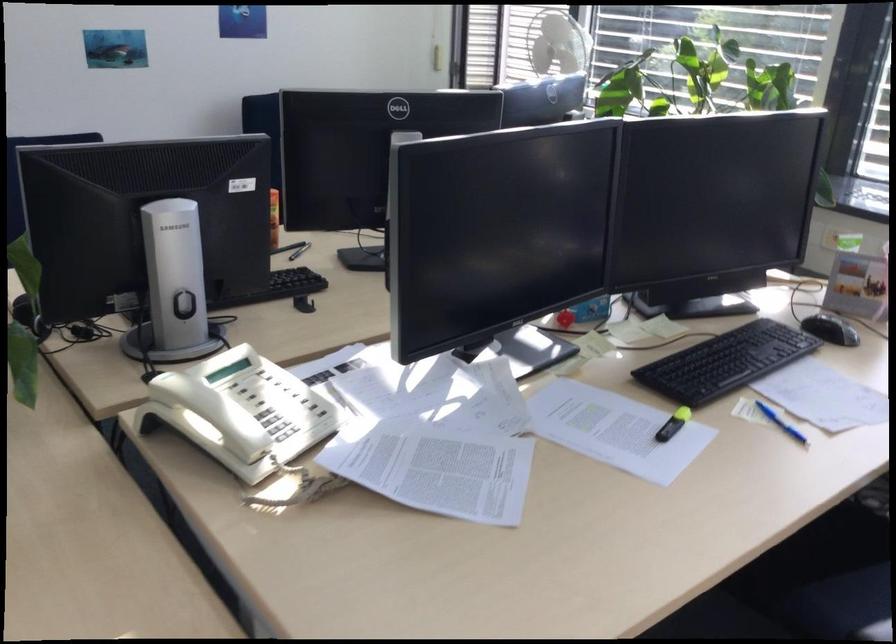
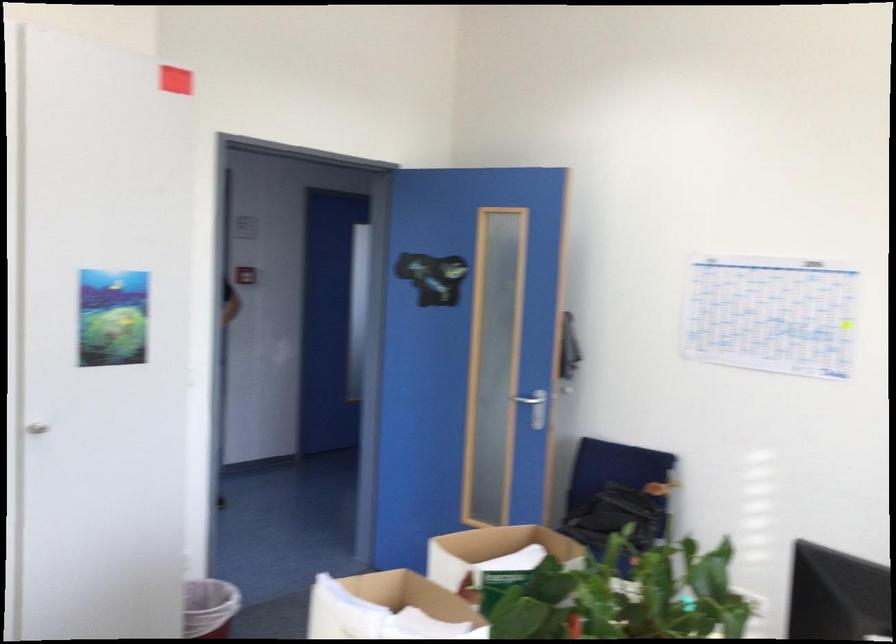
Question: The camera is either moving clockwise (left) or counter-clockwise (right) around the object. The first image is from the beginning of the video and the second image is from the end. Is the camera moving left or right when shooting the video?

Choices:
 (A) Left
 (B) Right

Answer: (B)